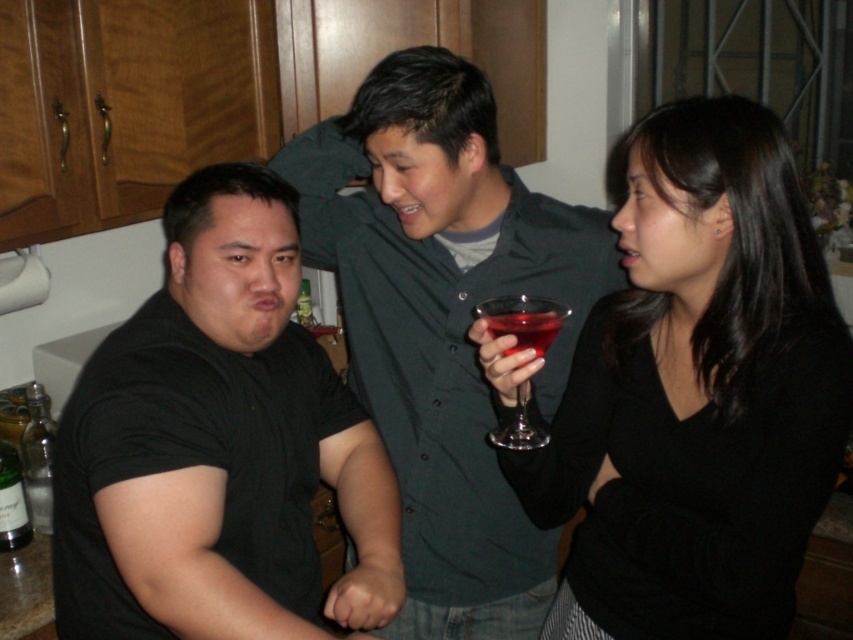
In the scene, there are a matte gray shirt at center and a translucent glass at center. Which object is wider?

The matte gray shirt at center is wider than the translucent glass at center.

You are a photographer trying to capture a candid shot of the matte gray shirt at center and the translucent glass at center. Considering their heights, which object should you focus on first to ensure both are in frame without adjusting your camera angle?

The matte gray shirt at center is much taller than the translucent glass at center, so you should focus on the taller matte gray shirt at center first to ensure the entire height of both objects fits within the frame.

You are standing in the kitchen and want to reach a point that is 3.46 feet away from you. Is the point at coordinates point (549,326) within your reach if your maximum reaching distance is 3.5 feet?

The point at point (549,326) is 3.46 feet away from the camera, so yes, it is within your reach since 3.46 feet is less than 3.5 feet.